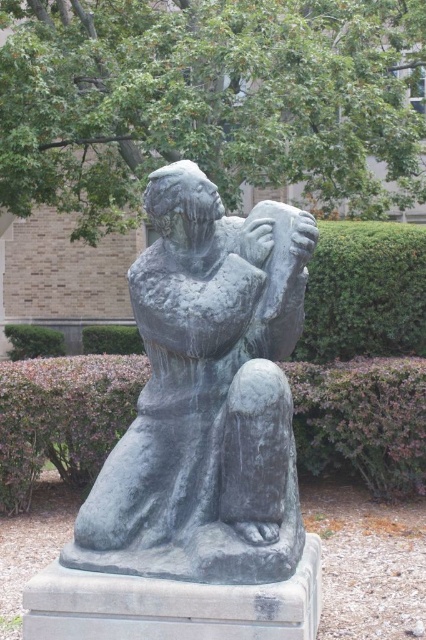
You are an artist planning to paint the sculpture in the park. You notice the green leafy tree at upper center and the purple shrubbery at lower center in your view. Which object should you paint first if you want to follow the rule of painting larger objects before smaller ones?

The green leafy tree at upper center is larger in size than the purple shrubbery at lower center, so you should paint the green leafy tree at upper center first.

You are standing in a park and see the green leafy tree at upper center and the bronze statue at center. Which object is positioned higher in the image?

The green leafy tree at upper center is positioned higher than the bronze statue at center.